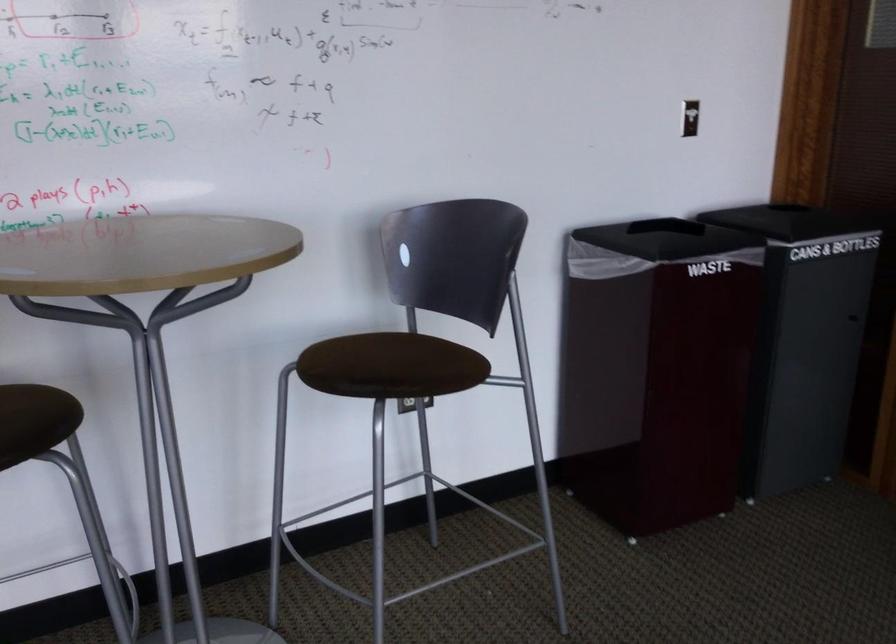
I want to click on red trash can lid, so click(x=793, y=222).